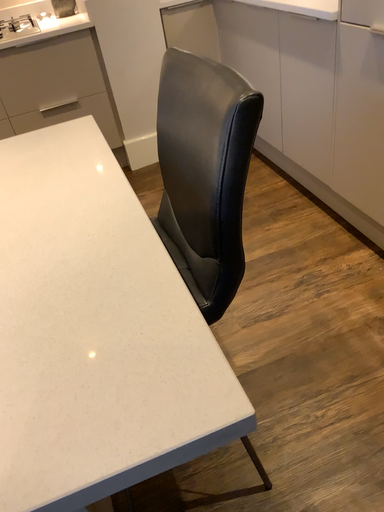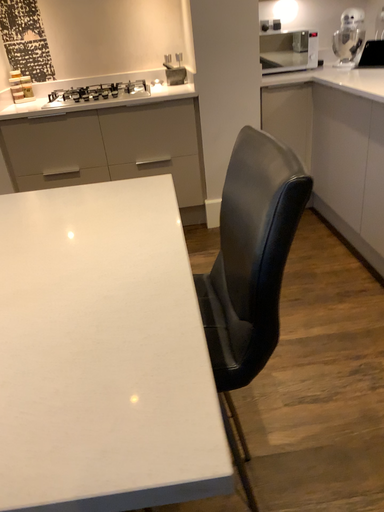
Question: Which way did the camera rotate in the video?

Choices:
 (A) rotated upward
 (B) rotated downward

Answer: (A)